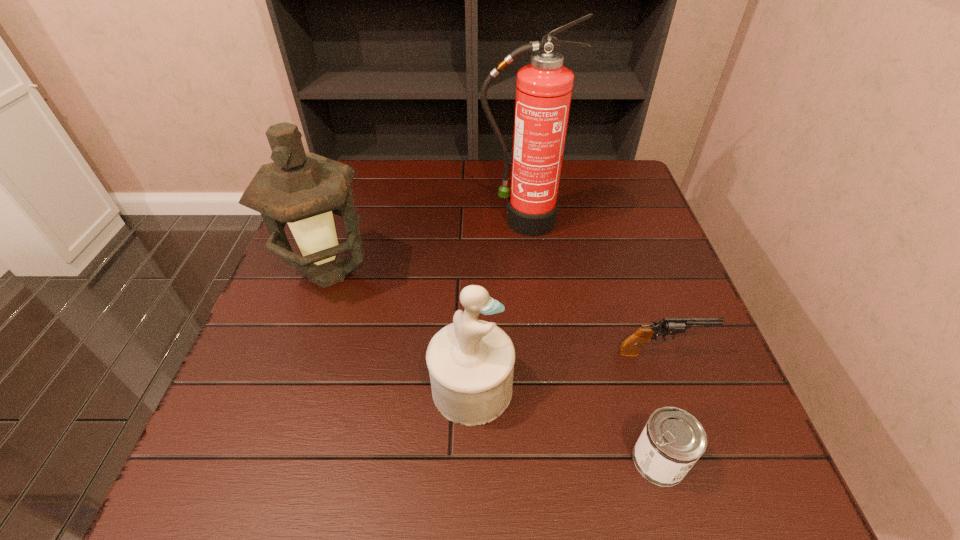
I want to click on blank area in the image that satisfies the following two spatial constraints: 1. at the beak of the figurine; 2. on the left side of the nearest object, so click(470, 460).